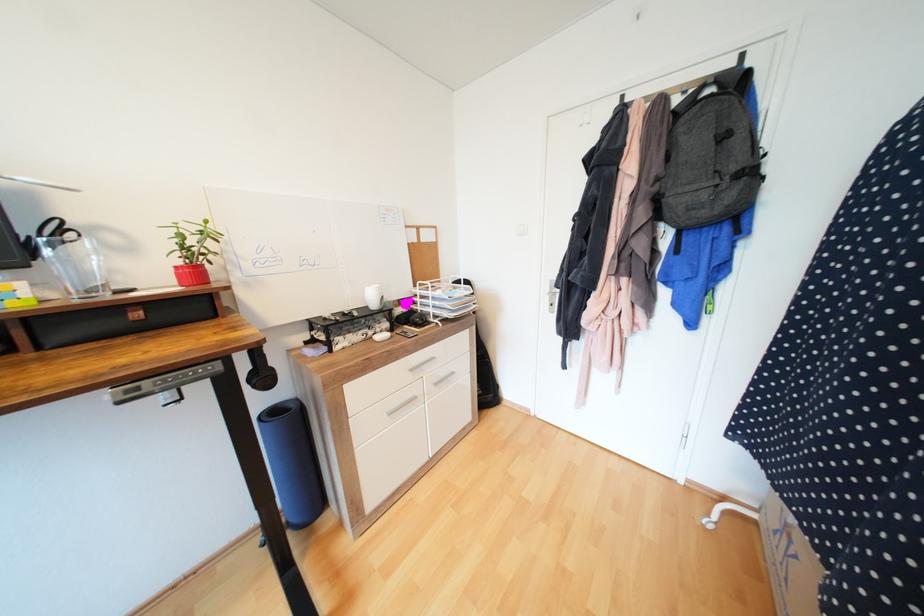
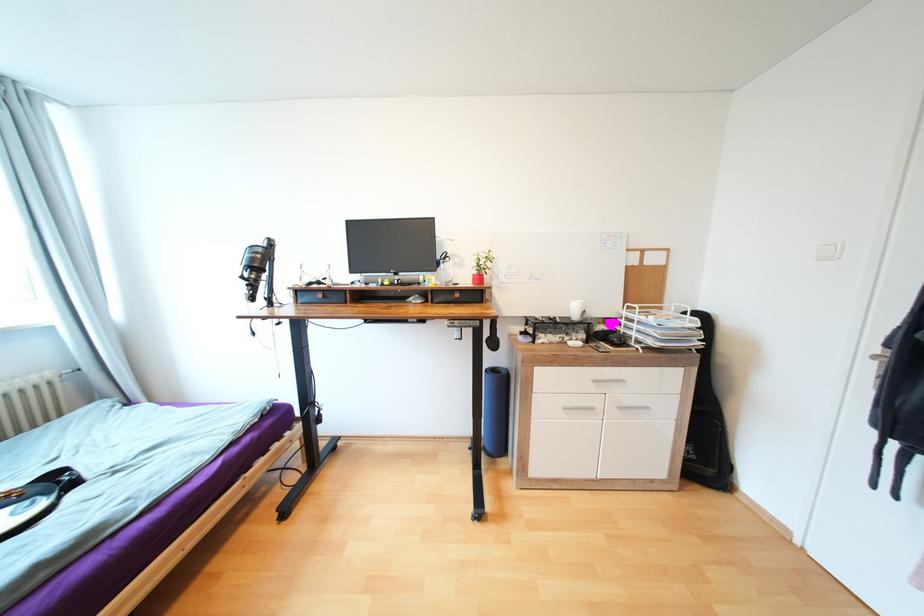
Question: How did the camera likely rotate?

Choices:
 (A) Left
 (B) Right
 (C) Up
 (D) Down

Answer: (A)